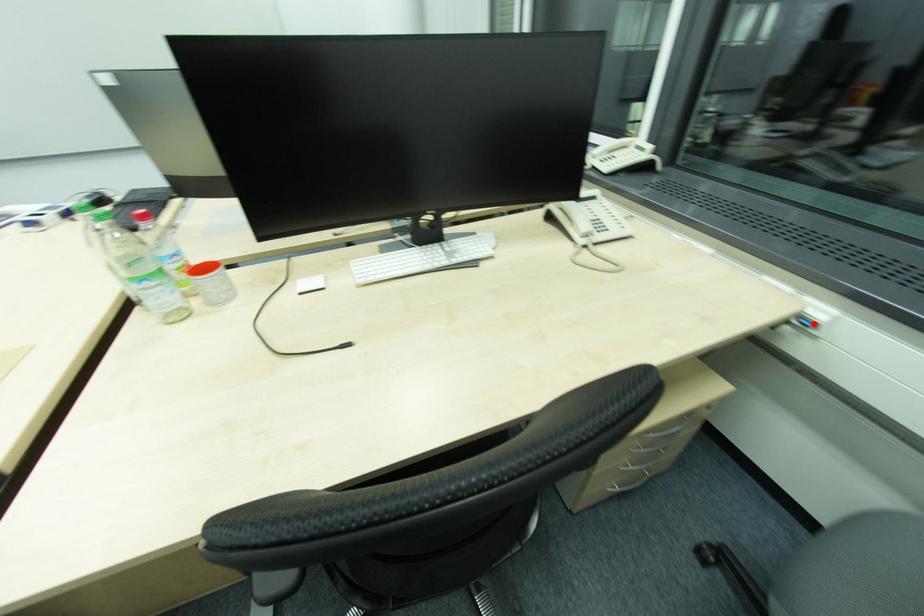
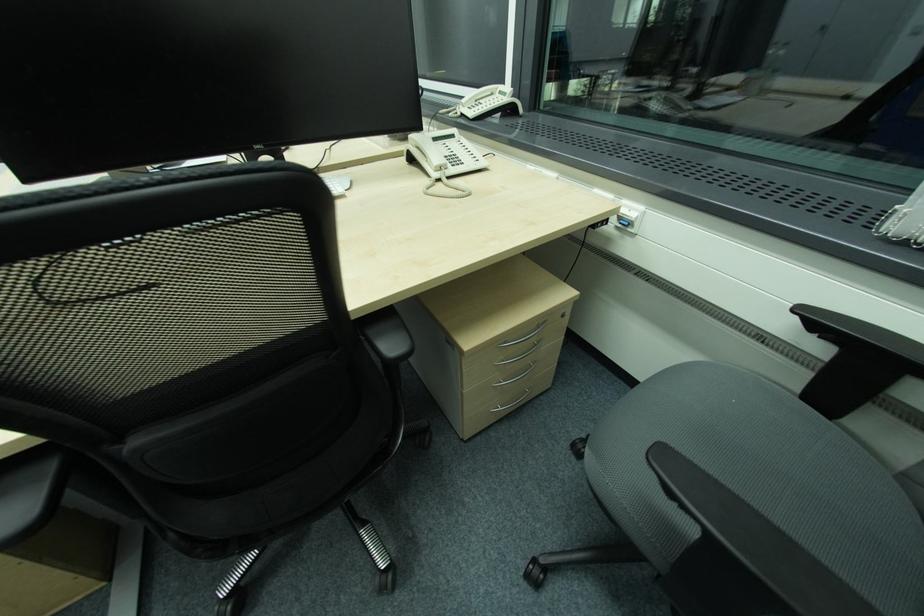
Question: I am providing you with two images of the same scene from different viewpoints. In image1, a red point is highlighted. Considering the same 3D point in image2, which of the following is correct?

Choices:
 (A) It is closer
 (B) It is farther

Answer: (A)